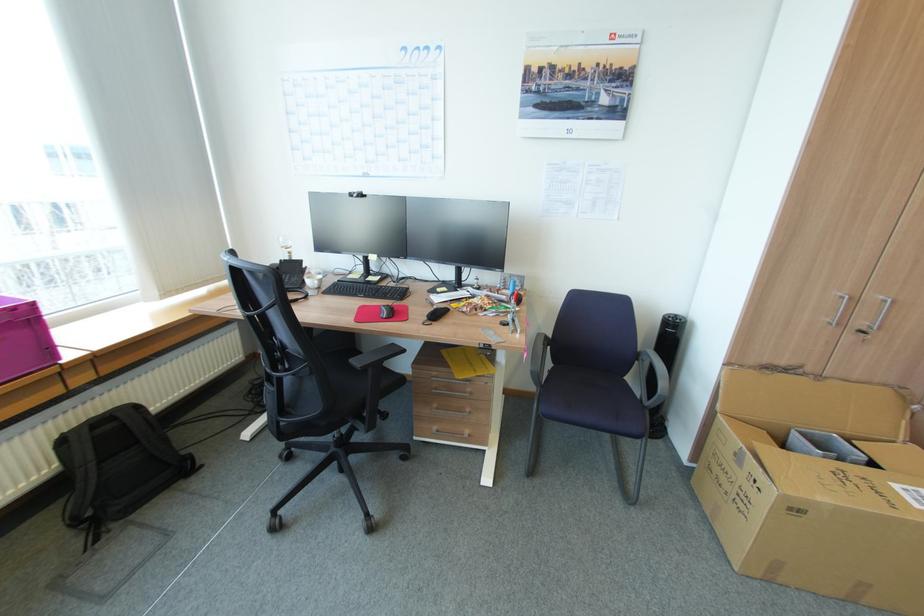
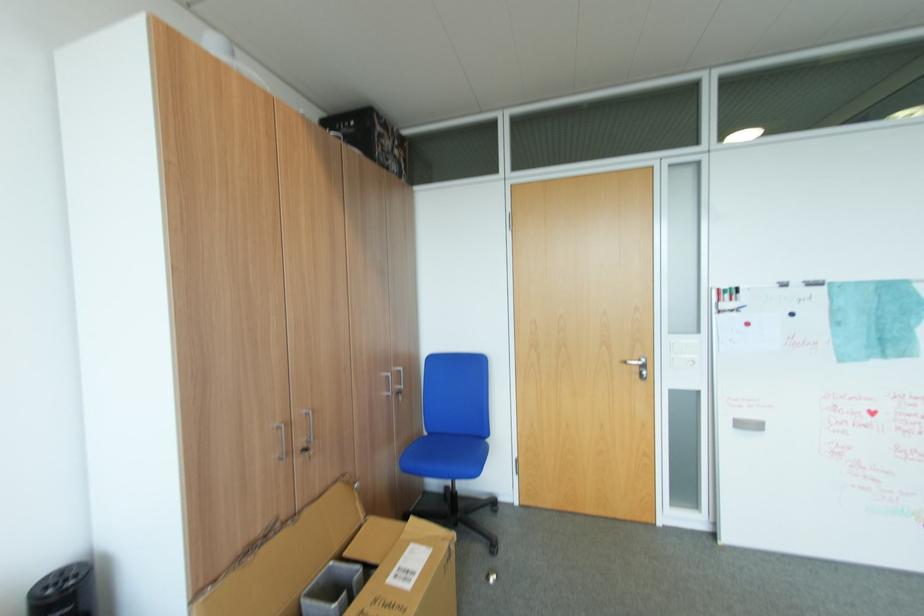
Locate, in the second image, the point that corresponds to pixel 868 331 in the first image.

(310, 451)